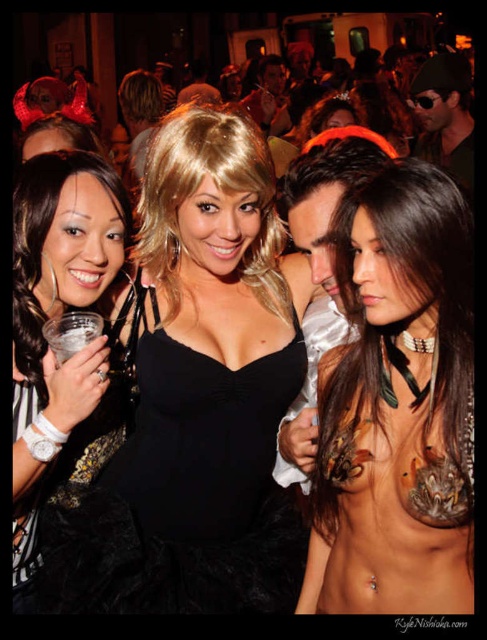
Looking at this image, you are a photographer at the event and need to ensure both the nude skin at center and the black velvet dress at center are clearly visible in your photo. Given their sizes, which one might require more careful framing to avoid being overshadowed?

The nude skin at center has a smaller size compared to the black velvet dress at center, so it might require more careful framing to avoid being overshadowed.

You are at a costume party and see the black lace dress at left and the clear plastic cup at left. Which object is positioned more to the left?

The black lace dress at left is positioned more to the left than the clear plastic cup at left.